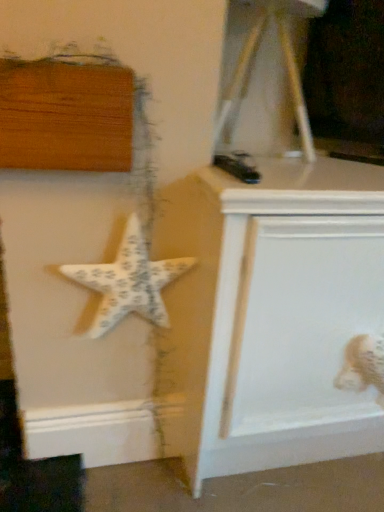
Question: Is white fabric toy at lower right inside the boundaries of white painted wood vanity at center, or outside?

Choices:
 (A) inside
 (B) outside

Answer: (A)

Question: Based on their positions, is white fabric toy at lower right located to the left or right of white painted wood vanity at center?

Choices:
 (A) left
 (B) right

Answer: (B)

Question: Which object is positioned closest to the white textured starfish at center-left?

Choices:
 (A) white painted wood vanity at center
 (B) white fabric toy at lower right

Answer: (A)

Question: Which object is positioned farthest from the white painted wood vanity at center?

Choices:
 (A) white textured starfish at center-left
 (B) white fabric toy at lower right

Answer: (B)